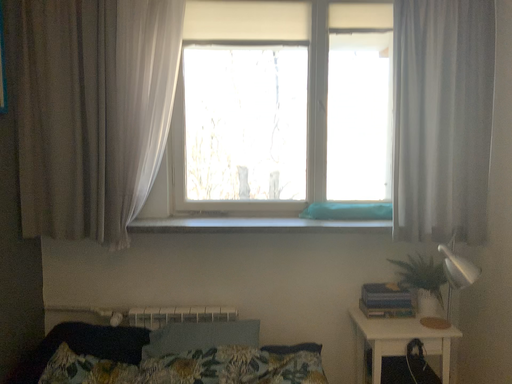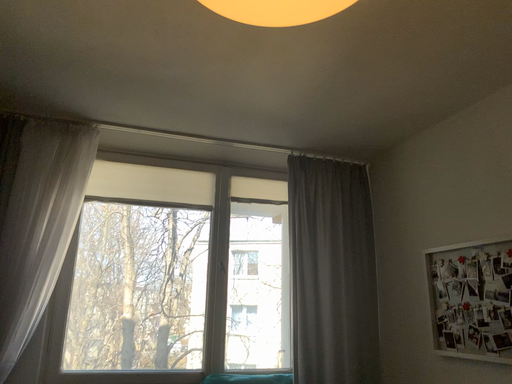
Question: How did the camera likely rotate when shooting the video?

Choices:
 (A) rotated right
 (B) rotated left

Answer: (A)